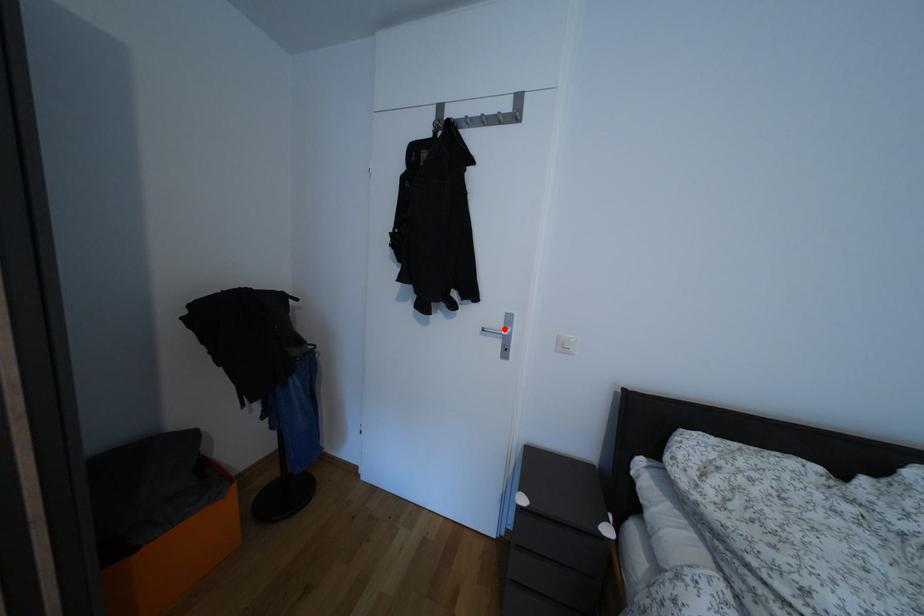
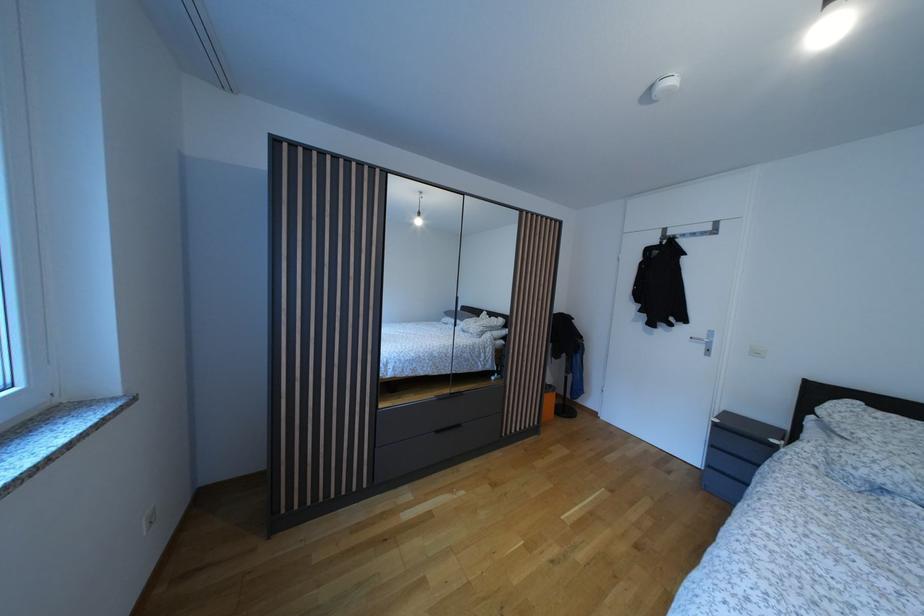
Question: I am providing you with two images of the same scene from different viewpoints. A red point is marked on the first image. Is the red point's position out of view in image 2?

Choices:
 (A) Yes
 (B) No

Answer: (B)